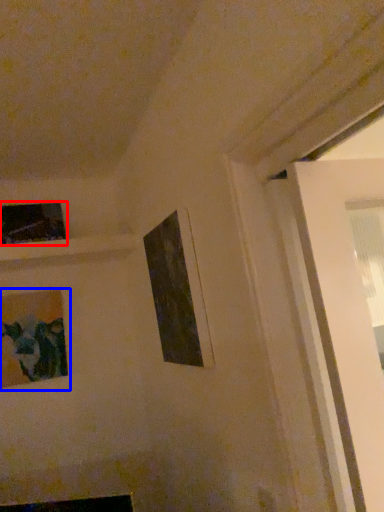
Question: Which point is further to the camera, picture frame (highlighted by a red box) or picture frame (highlighted by a blue box)?

Choices:
 (A) picture frame
 (B) picture frame

Answer: (A)